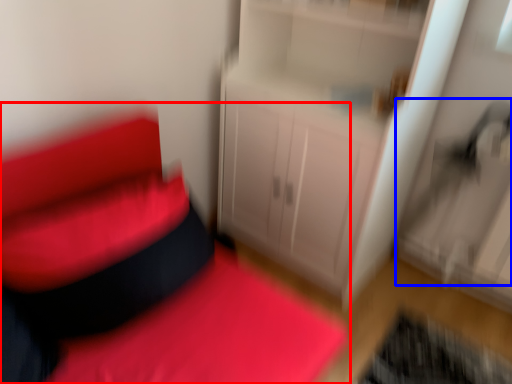
Question: Which of the following is the closest to the observer, furniture (highlighted by a red box) or swivel chair (highlighted by a blue box)?

Choices:
 (A) furniture
 (B) swivel chair

Answer: (A)